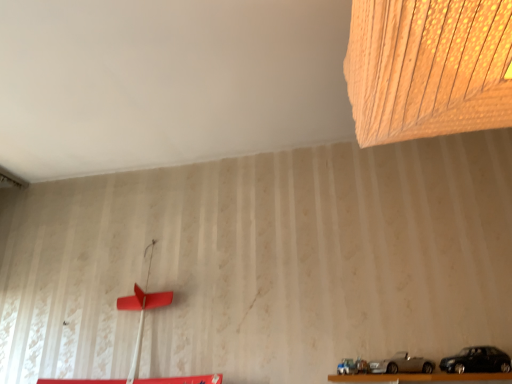
Question: Considering the relative positions of silver metallic car at lower center, the 2th car positioned from the right, and black matte car at lower right, the second car when ordered from left to right, in the image provided, is silver metallic car at lower center, the 2th car positioned from the right, to the left of black matte car at lower right, the second car when ordered from left to right, from the viewer's perspective?

Choices:
 (A) yes
 (B) no

Answer: (A)

Question: Is silver metallic car at lower center, which is the first car in left-to-right order, positioned in front of black matte car at lower right, the second car when ordered from left to right?

Choices:
 (A) yes
 (B) no

Answer: (B)

Question: From a real-world perspective, is silver metallic car at lower center, which is the first car in left-to-right order, physically above black matte car at lower right, the second car when ordered from left to right?

Choices:
 (A) no
 (B) yes

Answer: (A)

Question: Is silver metallic car at lower center, the 2th car positioned from the right, located outside black matte car at lower right, the second car when ordered from left to right?

Choices:
 (A) yes
 (B) no

Answer: (A)

Question: Is silver metallic car at lower center, which is the first car in left-to-right order, to the right of black matte car at lower right, which appears as the 1th car when viewed from the right, from the viewer's perspective?

Choices:
 (A) no
 (B) yes

Answer: (A)

Question: Visually, is silver metallic car at lower center, which is the first car in left-to-right order, positioned to the left or to the right of wooden textured lampshade at upper right?

Choices:
 (A) right
 (B) left

Answer: (A)

Question: Which is correct: silver metallic car at lower center, the 2th car positioned from the right, is inside wooden textured lampshade at upper right, or outside of it?

Choices:
 (A) inside
 (B) outside

Answer: (B)

Question: In terms of size, does silver metallic car at lower center, which is the first car in left-to-right order, appear bigger or smaller than wooden textured lampshade at upper right?

Choices:
 (A) big
 (B) small

Answer: (B)

Question: In the image, is silver metallic car at lower center, the 2th car positioned from the right, positioned in front of or behind wooden textured lampshade at upper right?

Choices:
 (A) front
 (B) behind

Answer: (B)

Question: From the image's perspective, relative to black matte car at lower right, the second car when ordered from left to right, is silver metallic car at lower center, which is the first car in left-to-right order, above or below?

Choices:
 (A) below
 (B) above

Answer: (A)

Question: Does point click(x=387, y=359) appear closer or farther from the camera than point click(x=487, y=352)?

Choices:
 (A) farther
 (B) closer

Answer: (A)

Question: Is silver metallic car at lower center, the 2th car positioned from the right, to the left or to the right of black matte car at lower right, the second car when ordered from left to right, in the image?

Choices:
 (A) left
 (B) right

Answer: (A)

Question: Is silver metallic car at lower center, the 2th car positioned from the right, in front of or behind black matte car at lower right, which appears as the 1th car when viewed from the right, in the image?

Choices:
 (A) front
 (B) behind

Answer: (B)

Question: Looking at the image, does black matte car at lower right, the second car when ordered from left to right, seem bigger or smaller compared to wooden textured lampshade at upper right?

Choices:
 (A) big
 (B) small

Answer: (B)

Question: Would you say black matte car at lower right, which appears as the 1th car when viewed from the right, is to the left or to the right of wooden textured lampshade at upper right in the picture?

Choices:
 (A) left
 (B) right

Answer: (B)